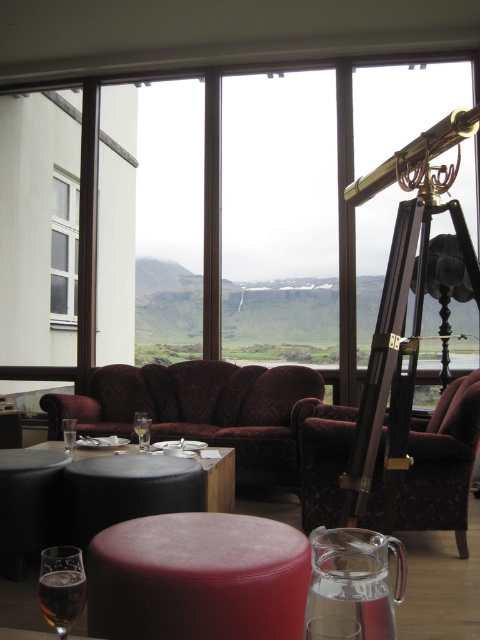
Question: Observing the image, what is the correct spatial positioning of velvet maroon couch at center in reference to velvet burgundy armchair at center?

Choices:
 (A) right
 (B) left

Answer: (B)

Question: Based on their relative distances, which object is nearer to the velvet red stool at center?

Choices:
 (A) clear glass wine at table left
 (B) clear glass wine glass at lower left

Answer: (B)

Question: Observing the image, what is the correct spatial positioning of velvet burgundy armchair at center in reference to clear glass wine glass at center?

Choices:
 (A) above
 (B) below

Answer: (B)

Question: From the image, what is the correct spatial relationship of velvet burgundy armchair at center in relation to black leather stool at lower left?

Choices:
 (A) right
 (B) left

Answer: (A)

Question: Among these points, which one is nearest to the camera?

Choices:
 (A) (118, 600)
 (B) (282, 468)

Answer: (A)

Question: Which point appears closest to the camera in this image?

Choices:
 (A) (137, 417)
 (B) (64, 433)
 (C) (348, 428)

Answer: (C)